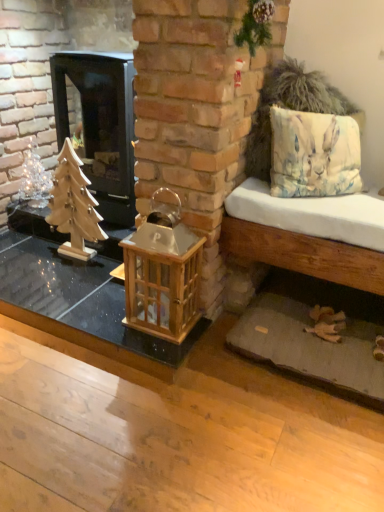
You are a GUI agent. You are given a task and a screenshot of the screen. Output one action in this format:
    pyautogui.click(x=<x>, y=<y>)
    Task: Click on the vacant position to the left of wooden lantern at center
    Image resolution: width=384 pixels, height=512 pixels.
    Given the screenshot: What is the action you would take?
    pyautogui.click(x=107, y=310)